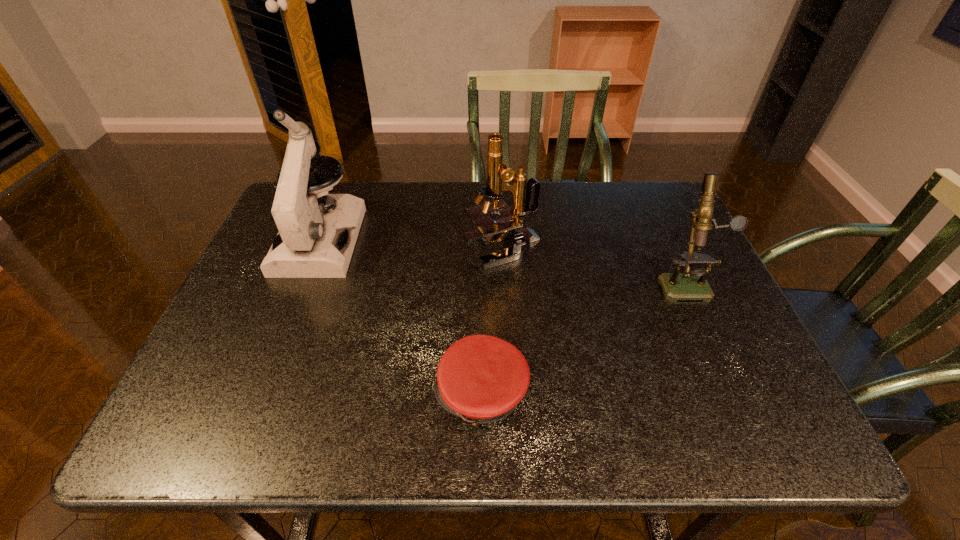
Where is `unoccupied position between the second microscope from left to right and the leftmost microscope`? unoccupied position between the second microscope from left to right and the leftmost microscope is located at coordinates 412,244.

The width and height of the screenshot is (960, 540). Find the location of `free spot between the second microscope from right to left and the shortest microscope`. free spot between the second microscope from right to left and the shortest microscope is located at coordinates (594, 264).

Select which object is the closest to the rightmost object. Please provide its 2D coordinates. Your answer should be formatted as a tuple, i.e. [(x, y)], where the tuple contains the x and y coordinates of a point satisfying the conditions above.

[(510, 226)]

Identify which object is the nearest to the leftmost microscope. Please provide its 2D coordinates. Your answer should be formatted as a tuple, i.e. [(x, y)], where the tuple contains the x and y coordinates of a point satisfying the conditions above.

[(510, 226)]

Select which microscope appears as the second closest to the rightmost object. Please provide its 2D coordinates. Your answer should be formatted as a tuple, i.e. [(x, y)], where the tuple contains the x and y coordinates of a point satisfying the conditions above.

[(310, 244)]

Find the location of a particular element. This screenshot has height=540, width=960. microscope that stands as the second closest to the second microscope from right to left is located at coordinates (310, 244).